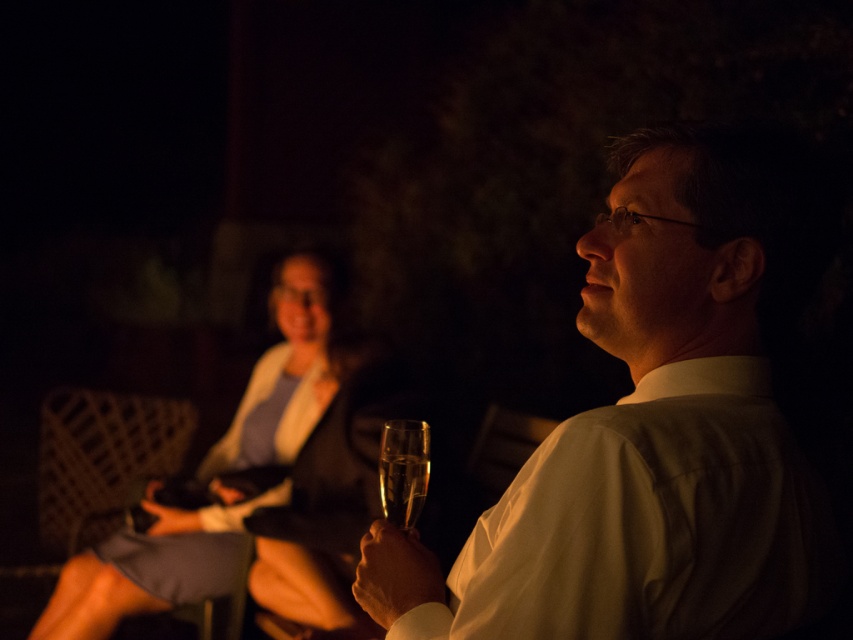
Is matte white shirt at center above matte black dress at center?

Yes, matte white shirt at center is above matte black dress at center.

What are the coordinates of `matte white shirt at center` in the screenshot? It's located at (659, 422).

You are a GUI agent. You are given a task and a screenshot of the screen. Output one action in this format:
    pyautogui.click(x=<x>, y=<y>)
    Task: Click on the matte white shirt at center
    
    Given the screenshot: What is the action you would take?
    pyautogui.click(x=659, y=422)

Can you confirm if matte white shirt at center is wider than clear glass wine glass at center?

Yes, matte white shirt at center is wider than clear glass wine glass at center.

Which is more to the left, matte white shirt at center or clear glass wine glass at center?

Positioned to the left is clear glass wine glass at center.

In order to click on matte white shirt at center in this screenshot , I will do `click(659, 422)`.

Find the location of a particular element. This screenshot has width=853, height=640. matte white shirt at center is located at coordinates (659, 422).

Which is below, matte black dress at center or clear glass wine glass at center?

matte black dress at center is below.

Where is `matte black dress at center`? The width and height of the screenshot is (853, 640). matte black dress at center is located at coordinates (149, 566).